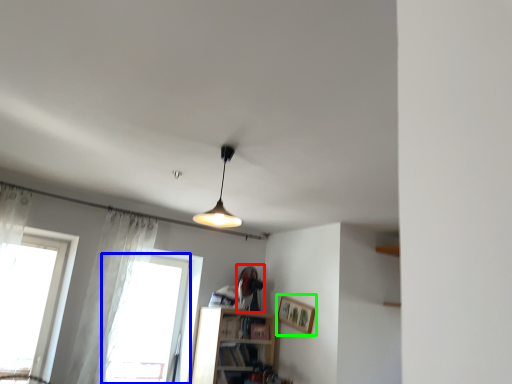
Question: Considering the real-world distances, which object is closest to fan (highlighted by a red box)? window (highlighted by a blue box) or picture frame (highlighted by a green box).

Choices:
 (A) window
 (B) picture frame

Answer: (B)